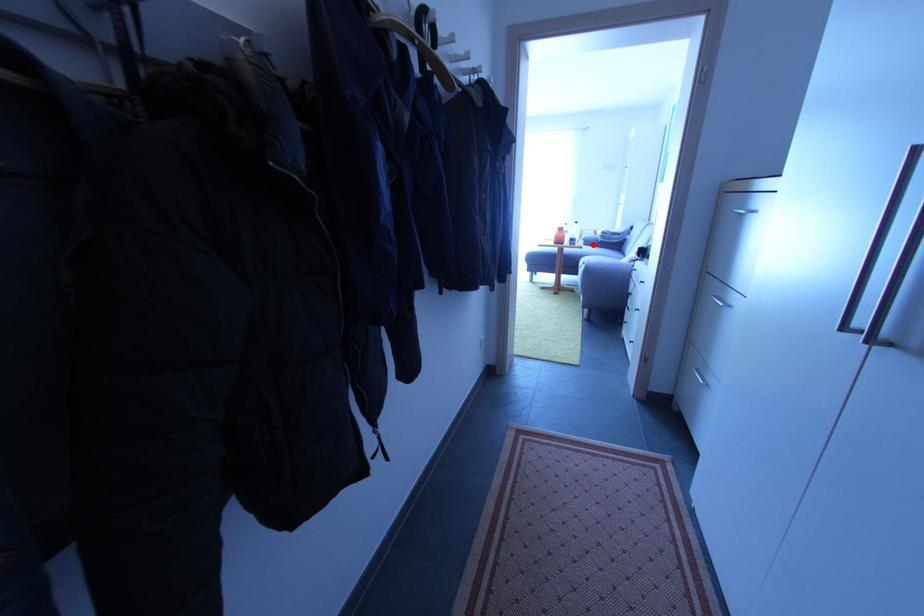
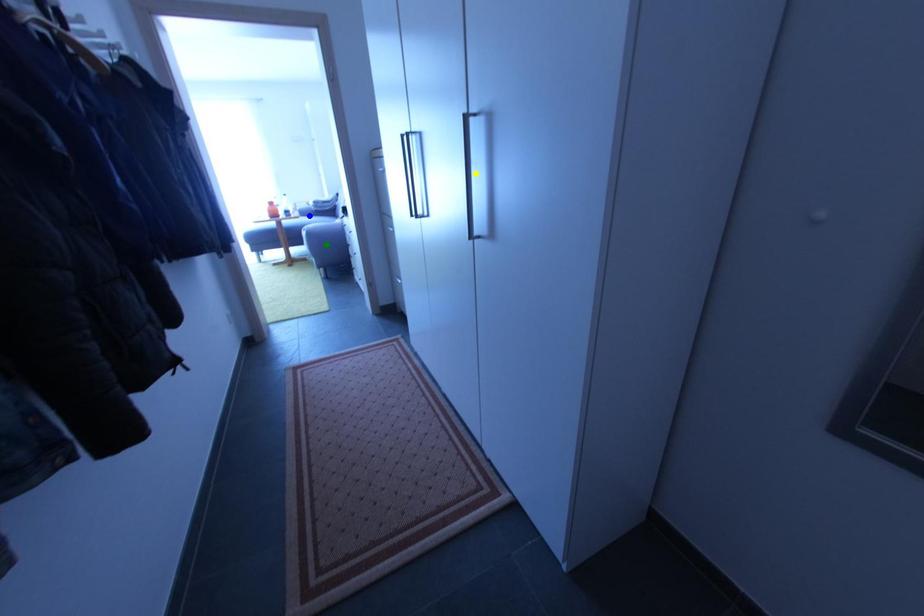
Question: I am providing you with two images of the same scene from different viewpoints. A red point is marked on the first image. You are given multiple points on the second image. Can you choose the point in image 2 that corresponds to the point in image 1?

Choices:
 (A) blue point
 (B) green point
 (C) yellow point

Answer: (A)